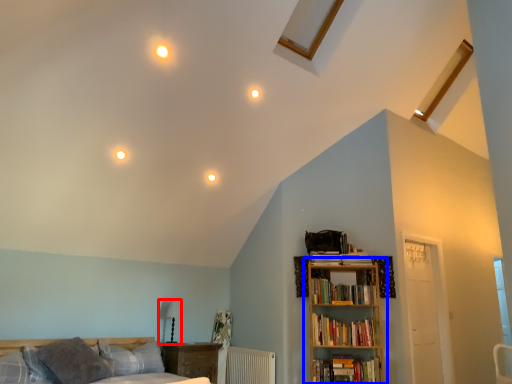
Question: Which point is closer to the camera, table lamp (highlighted by a red box) or bookcase (highlighted by a blue box)?

Choices:
 (A) table lamp
 (B) bookcase

Answer: (B)